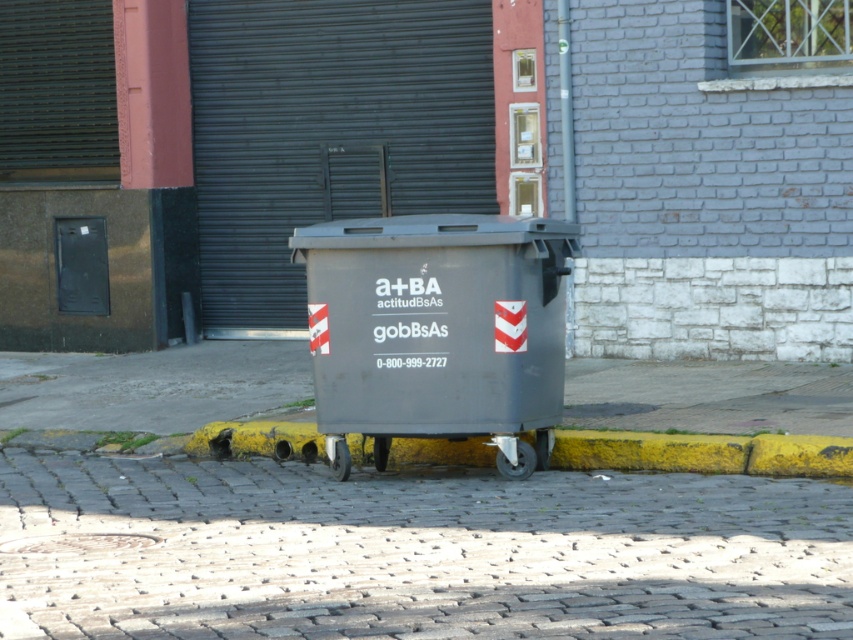
Who is positioned more to the right, cobblestone pavement at center or yellow painted curb at lower center?

From the viewer's perspective, yellow painted curb at lower center appears more on the right side.

Where is `cobblestone pavement at center`? The height and width of the screenshot is (640, 853). cobblestone pavement at center is located at coordinates (413, 552).

You are a GUI agent. You are given a task and a screenshot of the screen. Output one action in this format:
    pyautogui.click(x=<x>, y=<y>)
    Task: Click on the cobblestone pavement at center
    
    Given the screenshot: What is the action you would take?
    pyautogui.click(x=413, y=552)

Can you confirm if gray plastic recycling bin at center is taller than yellow painted curb at lower center?

Indeed, gray plastic recycling bin at center has a greater height compared to yellow painted curb at lower center.

Can you confirm if gray plastic recycling bin at center is wider than yellow painted curb at lower center?

In fact, gray plastic recycling bin at center might be narrower than yellow painted curb at lower center.

Who is more forward, (434, 376) or (300, 440)?

Positioned in front is point (434, 376).

The height and width of the screenshot is (640, 853). Find the location of `gray plastic recycling bin at center`. gray plastic recycling bin at center is located at coordinates (437, 330).

Is cobblestone pavement at center further to the viewer compared to gray plastic recycling bin at center?

No, it is in front of gray plastic recycling bin at center.

Is point (149, 520) behind point (489, 234)?

No, (149, 520) is closer to viewer.

What do you see at coordinates (413, 552) in the screenshot?
I see `cobblestone pavement at center` at bounding box center [413, 552].

The image size is (853, 640). I want to click on cobblestone pavement at center, so click(413, 552).